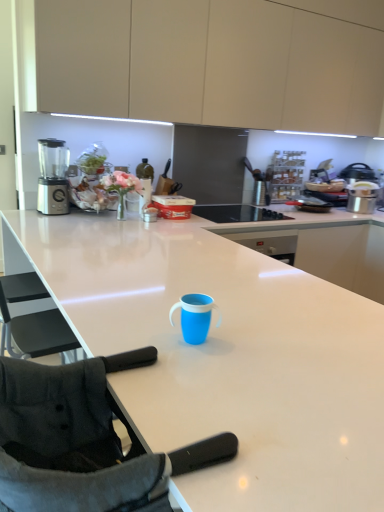
You are a GUI agent. You are given a task and a screenshot of the screen. Output one action in this format:
    pyautogui.click(x=<x>, y=<y>)
    Task: Click on the free space in front of blue plastic sippy cup at center
    Image resolution: width=384 pixels, height=512 pixels.
    Given the screenshot: What is the action you would take?
    pyautogui.click(x=188, y=372)